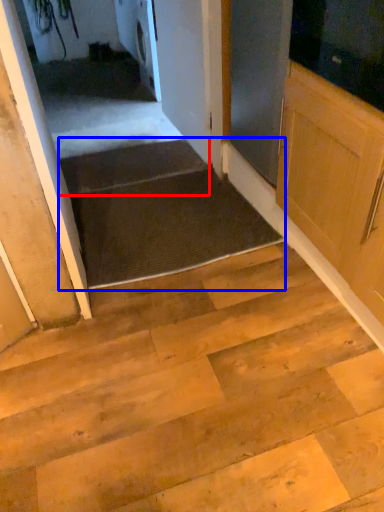
Question: Which point is further to the camera, stairs (highlighted by a red box) or stairwell (highlighted by a blue box)?

Choices:
 (A) stairs
 (B) stairwell

Answer: (A)